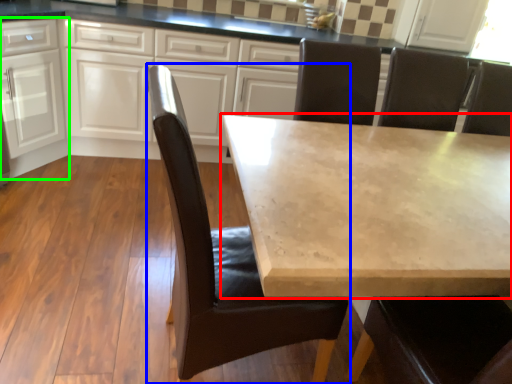
Question: Based on their relative distances, which object is nearer to table (highlighted by a red box)? Choose from chair (highlighted by a blue box) and cabinetry (highlighted by a green box).

Choices:
 (A) chair
 (B) cabinetry

Answer: (A)